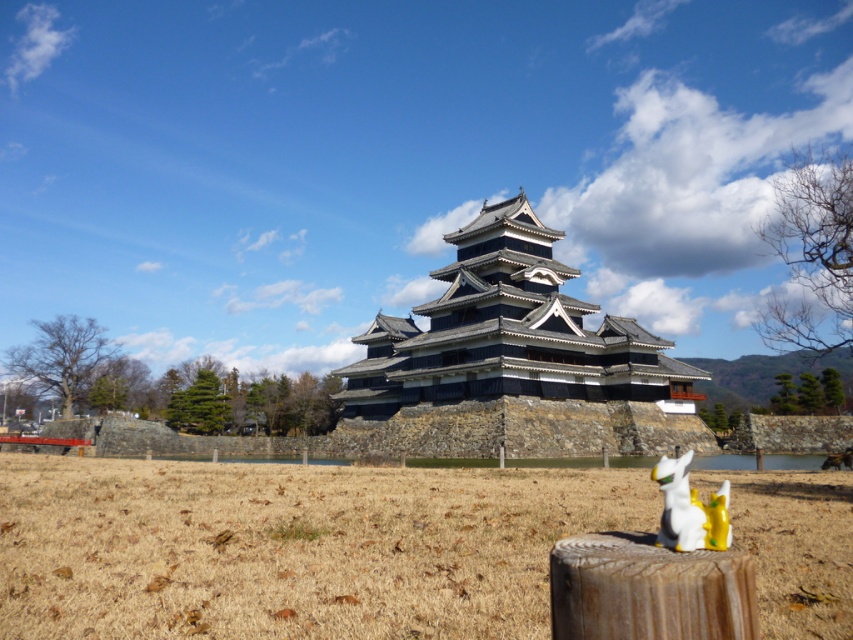
You are a tourist standing at the entrance of Matsumoto Castle. You notice the brown grass at center and the dark gray stone fort at center. How far apart are these two landmarks?

The brown grass at center is 37.09 meters from dark gray stone fort at center.

You are an artist planning to paint the scene of Matsumoto Castle. You want to ensure the brown grass at center and the white glossy statue at lower right are proportionally accurate. Based on their sizes in the image, which object should you paint smaller?

The brown grass at center should be painted smaller because it occupies less space than the white glossy statue at lower right according to the description.

You are a visitor at Matsumoto Castle and notice two elements in the scene. One is the brown grass at center and the other is the dark gray stone fort at center. From your vantage point, which one appears closer to the ground?

The brown grass at center is below the dark gray stone fort at center, so it appears closer to the ground.